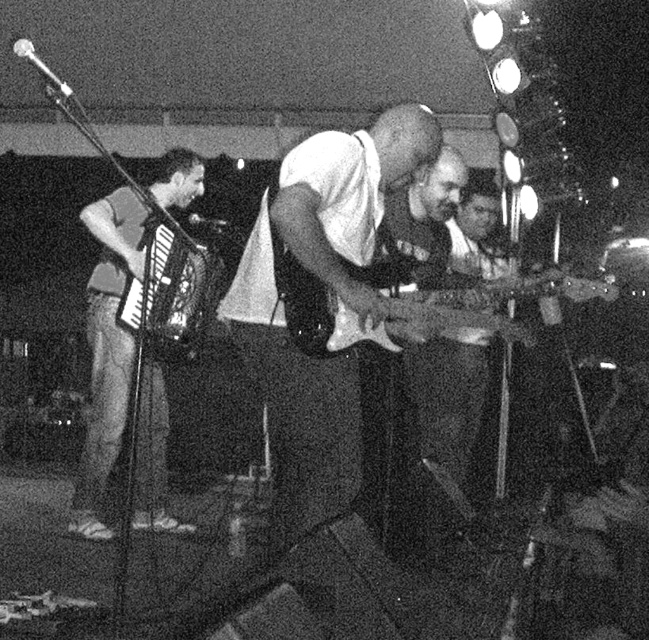
You are a photographer at the back of the stage. You want to take a photo of the white matte guitar at center and the matte gray accordion at left. Which one will be closer to the camera in the photo?

The white matte guitar at center is in front of the matte gray accordion at left, so it will appear closer to the camera in the photo.

You are standing at the center of the stage and want to move to the left side to adjust the microphone stand. To avoid stepping on the matte gray accordion at left, which is located at point (106,355), should you move forward or backward?

You should move backward because the matte gray accordion at left is located at point (106,355), which is in front of you. Moving backward would help you avoid stepping on it.